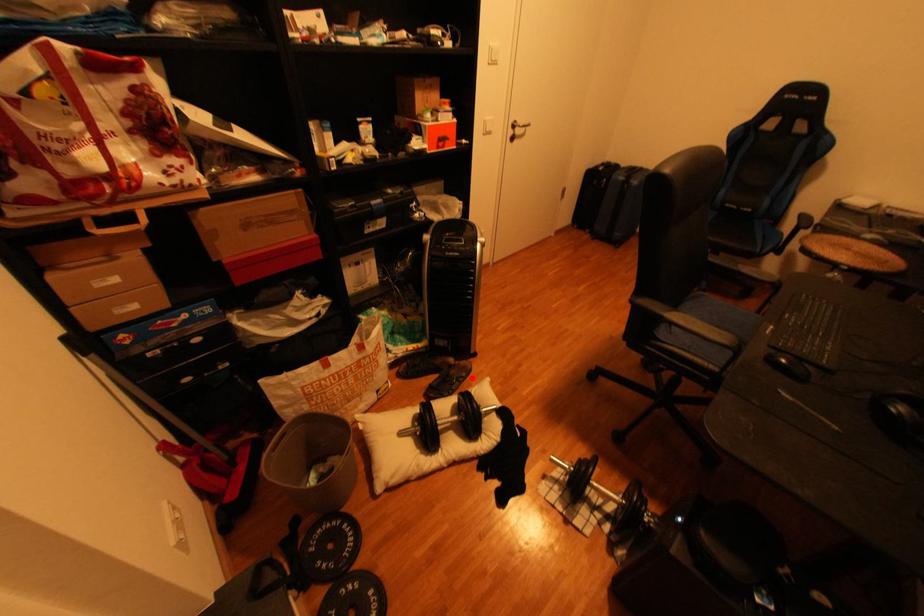
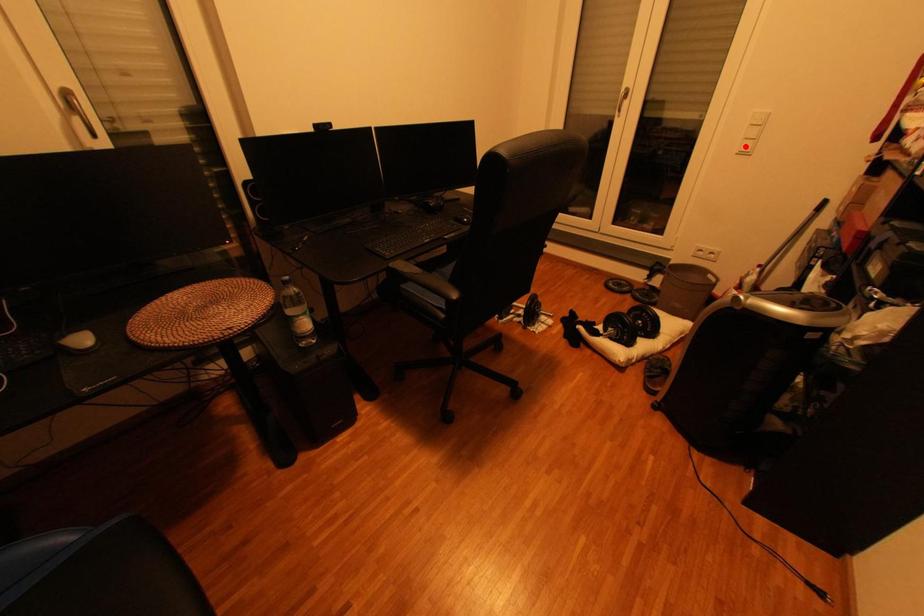
I am providing you with two images of the same scene from different viewpoints. A red point is marked on the first image and another point is marked on the second image. Do the highlighted points in image1 and image2 indicate the same real-world spot?

No